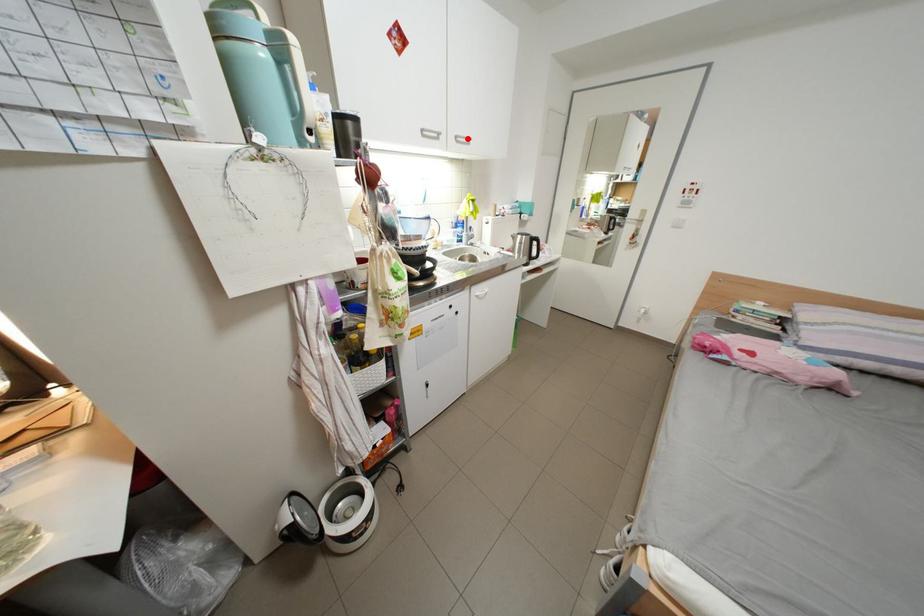
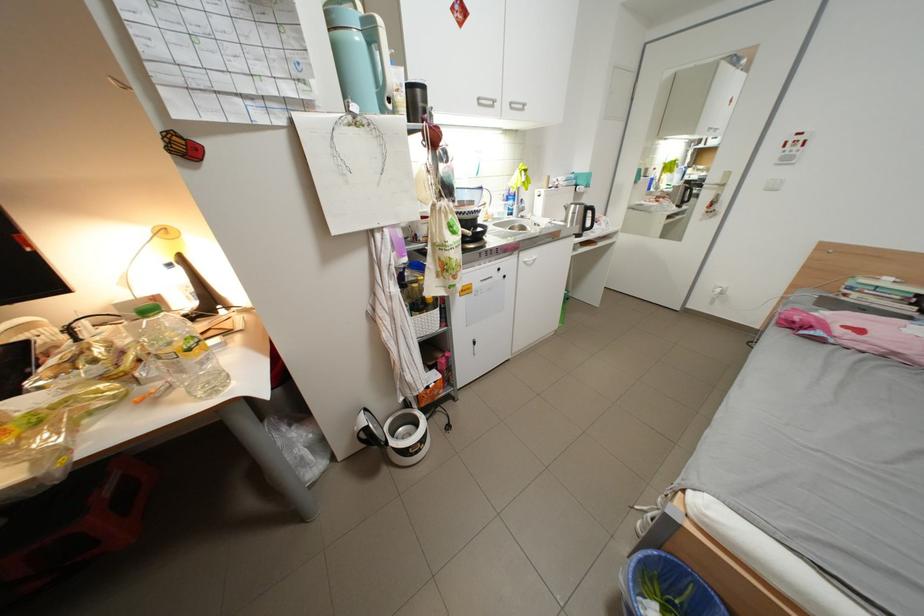
Find the pixel in the second image that matches the highlighted location in the first image.

(523, 105)